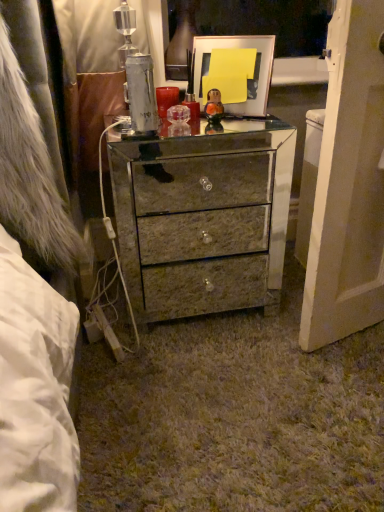
Where is `free space in front of mirrored glass chest of drawers at center`? free space in front of mirrored glass chest of drawers at center is located at coordinates (204, 384).